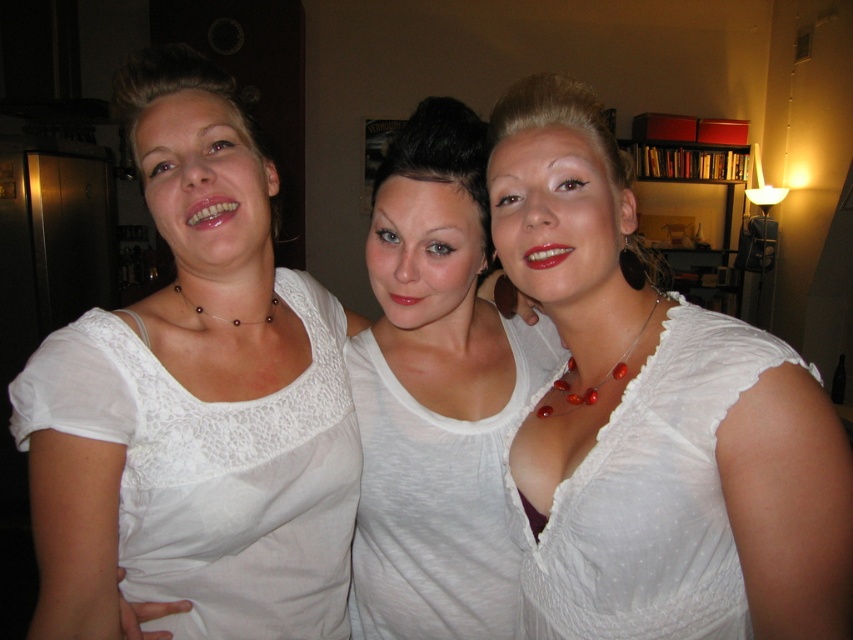
Between white lace blouse at left and white sheer dress at center, which one has more height?

white lace blouse at left

Is point (33, 362) positioned after point (631, 496)?

Yes.

Find the location of a particular element. The width and height of the screenshot is (853, 640). white lace blouse at left is located at coordinates (195, 404).

Which is above, white lace top at center or white sheer dress at center?

white lace top at center

Looking at this image, between white lace top at center and white sheer dress at center, which one is positioned lower?

Positioned lower is white sheer dress at center.

Is point (424, 168) in front of point (601, 451)?

That is False.

Where is `white lace top at center`? The width and height of the screenshot is (853, 640). white lace top at center is located at coordinates (436, 394).

Can you confirm if white lace blouse at left is positioned to the left of white lace top at center?

Correct, you'll find white lace blouse at left to the left of white lace top at center.

Does point (323, 506) lie in front of point (379, 541)?

Yes, it is in front of point (379, 541).

Which is behind, point (224, 516) or point (386, 564)?

Positioned behind is point (386, 564).

Find the location of a particular element. Image resolution: width=853 pixels, height=640 pixels. white lace blouse at left is located at coordinates (195, 404).